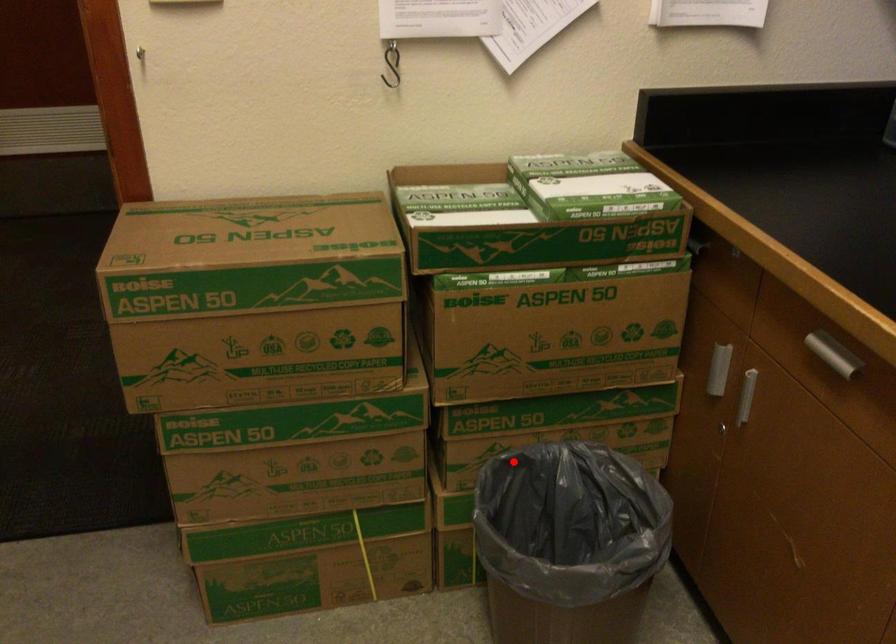
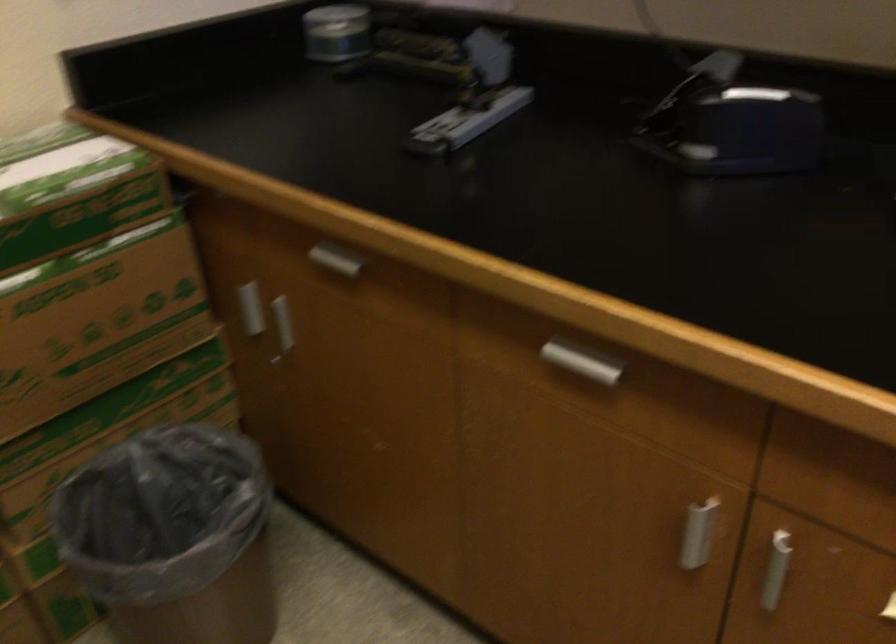
Locate, in the second image, the point that corresponds to the highlighted location in the first image.

(91, 474)